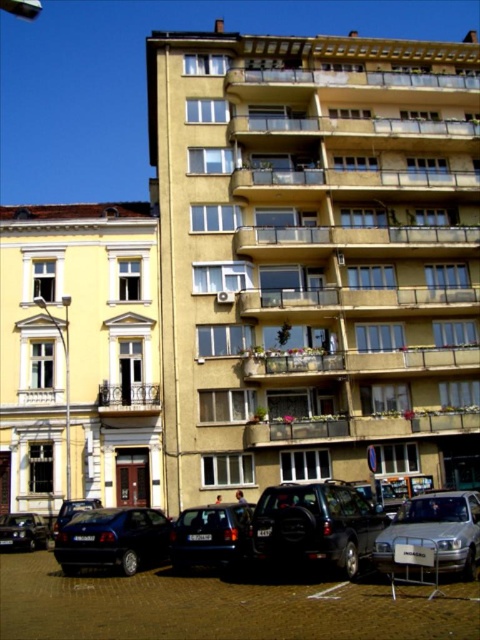
You are standing at the entrance of the residential building and want to park your car. The shiny dark blue sedan at lower left is currently occupying a spot. Is there enough space to park your car next to it without crossing the road?

The question cannot be answered with the provided information because the scene description does not include details about parking spaces, road dimensions, or the availability of adjacent spots near the shiny dark blue sedan at lower left.

You are a pedestrian standing at the entrance of the residential building. You see a shiny black suv at center and a shiny black car at lower left. Which vehicle is positioned closer to the yellowish classical structure on the left?

The shiny black car at lower left is positioned closer to the yellowish classical structure on the left because it is located to the left of the shiny black suv at center, which is further away from the structure.

You are standing in front of the residential building and see both the shiny dark blue sedan at lower left and the shiny black car at lower left. Which car is nearer to you?

The shiny dark blue sedan at lower left is closer to the viewer than the shiny black car at lower left.